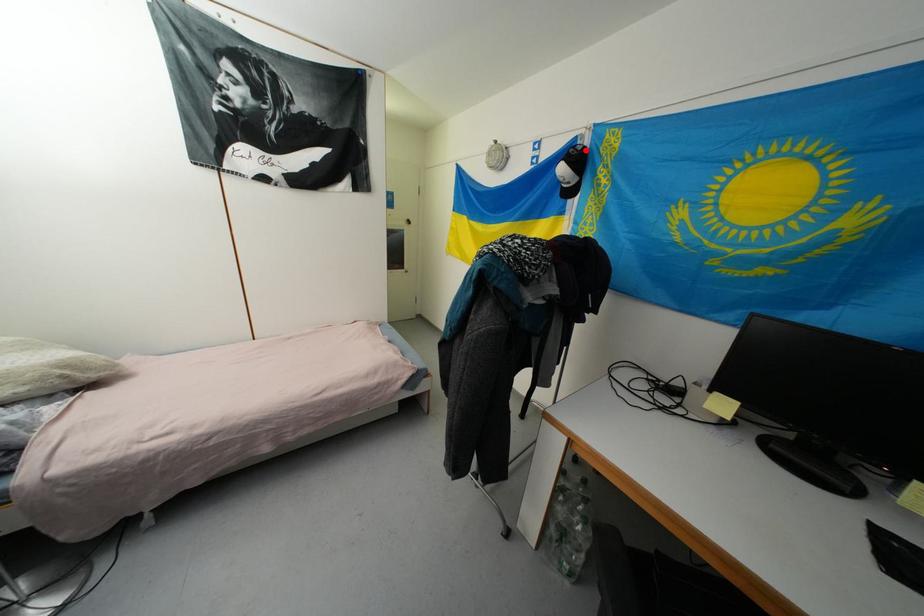
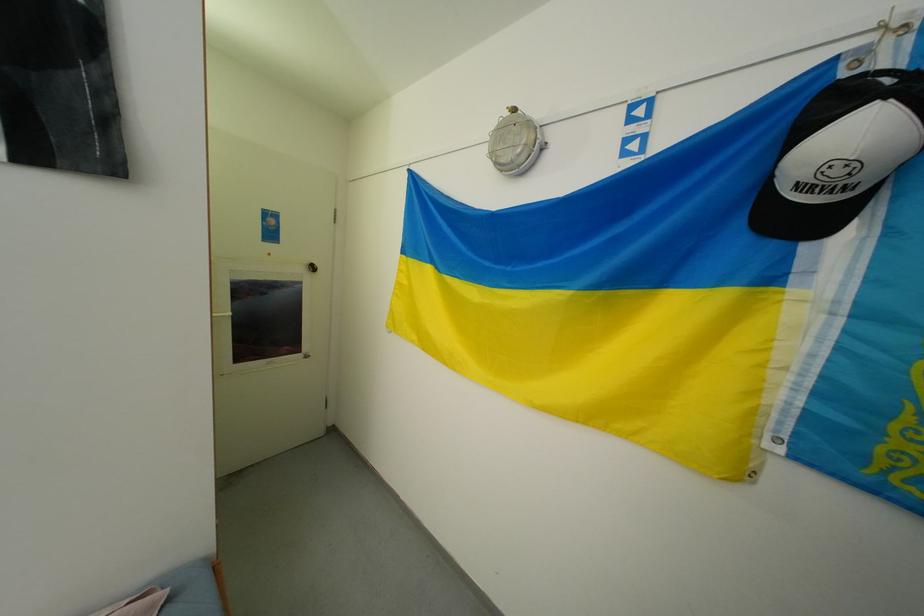
Find the pixel in the second image that matches the highlighted location in the first image.

(896, 81)